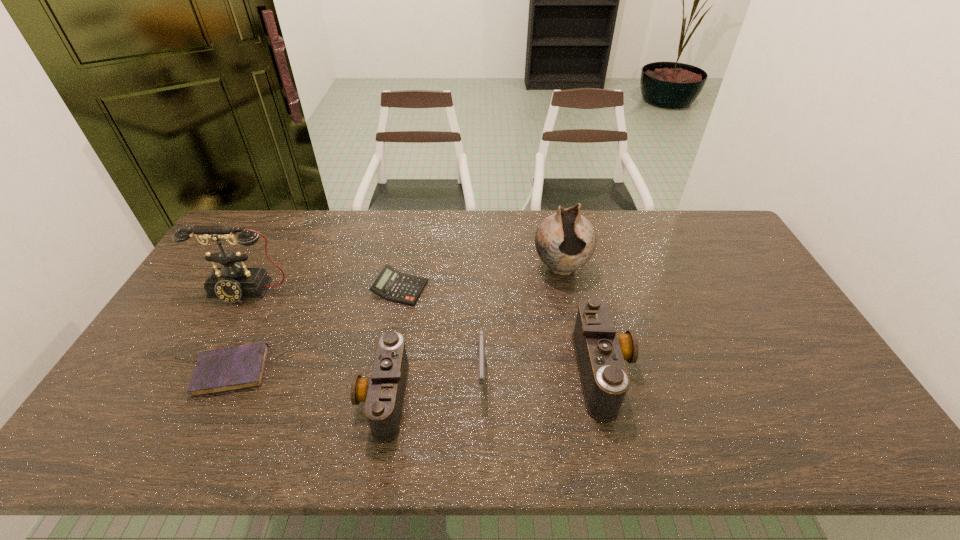
Where is `the left camera`? the left camera is located at coordinates (383, 392).

You are a GUI agent. You are given a task and a screenshot of the screen. Output one action in this format:
    pyautogui.click(x=<x>, y=<y>)
    Task: Click on the right camera
    This screenshot has height=540, width=960.
    Given the screenshot: What is the action you would take?
    pyautogui.click(x=600, y=352)

Image resolution: width=960 pixels, height=540 pixels. I want to click on the fifth shortest object, so click(x=600, y=352).

Identify the location of the sixth tallest object. The image size is (960, 540). (392, 285).

Identify the location of telephone. (233, 281).

Where is `pottery`? pottery is located at coordinates (565, 241).

The height and width of the screenshot is (540, 960). Identify the location of pistol. (481, 343).

Where is `the shortest object`? the shortest object is located at coordinates (226, 369).

At what (x,y) coordinates should I click in order to perform the action: click on vacant region located on the lens of the left camera. Please return your answer as a coordinate pair (x, y). Image resolution: width=960 pixels, height=540 pixels. Looking at the image, I should click on (245, 396).

Where is `free space located on the lens of the left camera`? free space located on the lens of the left camera is located at coordinates (324, 396).